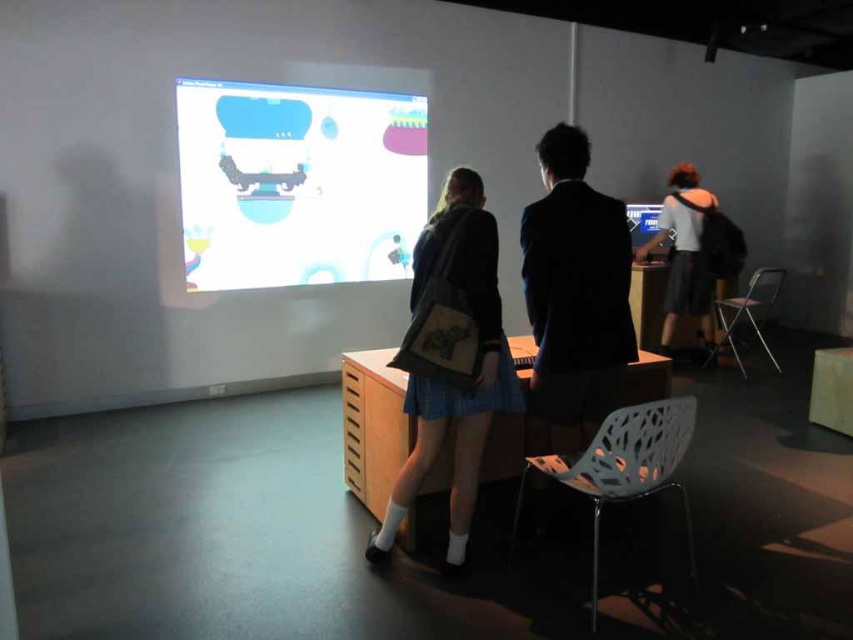
Question: Does white plastic chair at lower right appear over metallic silver screen at center?

Choices:
 (A) yes
 (B) no

Answer: (B)

Question: Can you confirm if white glossy projection screen at upper center is positioned to the right of metallic silver screen at center?

Choices:
 (A) yes
 (B) no

Answer: (B)

Question: Which of the following is the farthest from the observer?

Choices:
 (A) white glossy projection screen at upper center
 (B) black matte suit at center
 (C) metallic silver screen at center

Answer: (C)

Question: Does white glossy projection screen at upper center appear on the left side of metallic silver screen at center?

Choices:
 (A) yes
 (B) no

Answer: (A)

Question: Estimate the real-world distances between objects in this image. Which object is farther from the metallic silver chair at right?

Choices:
 (A) metallic silver screen at center
 (B) denim skirt at center
 (C) black matte suit at center
 (D) white plastic chair at lower right

Answer: (B)

Question: Among these objects, which one is farthest from the camera?

Choices:
 (A) white glossy projection screen at upper center
 (B) black matte suit at center
 (C) gray fabric shirt at center right
 (D) denim skirt at center

Answer: (C)